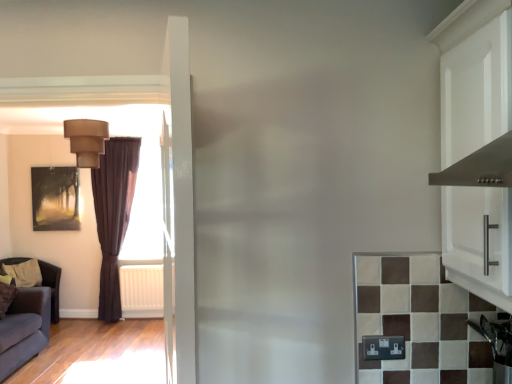
Question: From the image's perspective, is stainless steel oven at lower right positioned above or below brown velvet curtain at left?

Choices:
 (A) above
 (B) below

Answer: (B)

Question: In the image, is stainless steel oven at lower right on the left side or the right side of brown velvet curtain at left?

Choices:
 (A) left
 (B) right

Answer: (B)

Question: Estimate the real-world distances between objects in this image. Which object is closer to the white plastic radiator at left?

Choices:
 (A) dark gray fabric couch at lower left
 (B) brown velvet curtain at left
 (C) dark brown leather armchair at left
 (D) matte beige lampshade at upper left
 (E) matte black painting at left

Answer: (B)

Question: Estimate the real-world distances between objects in this image. Which object is farther from the matte beige lampshade at upper left?

Choices:
 (A) dark gray fabric couch at lower left
 (B) dark brown leather armchair at left
 (C) matte black painting at left
 (D) brown velvet curtain at left
 (E) white plastic radiator at left

Answer: (B)